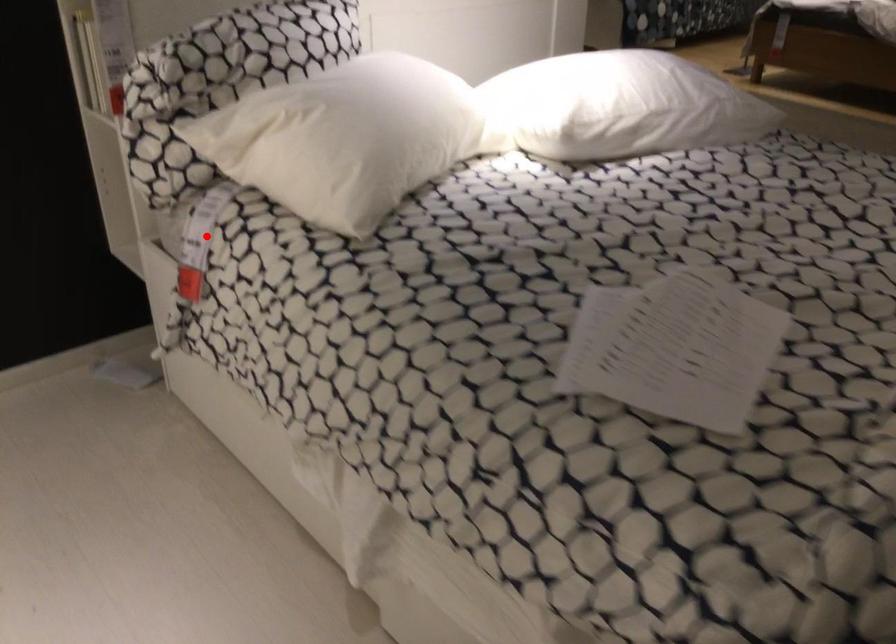
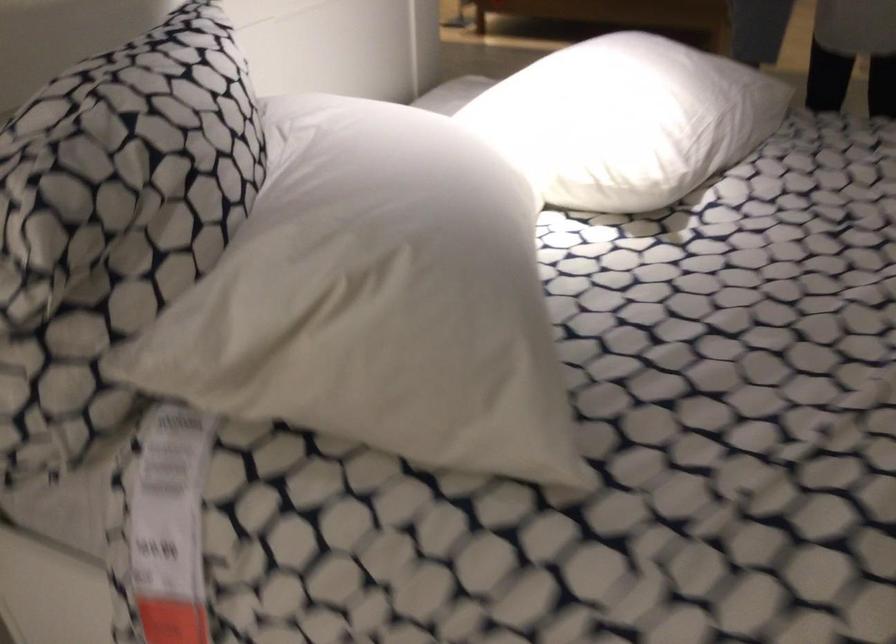
Question: A red point is marked in image1. In image2, is the corresponding 3D point closer to the camera or farther? Reply with the corresponding letter.

Choices:
 (A) The corresponding 3D point is closer.
 (B) The corresponding 3D point is farther.

Answer: (A)